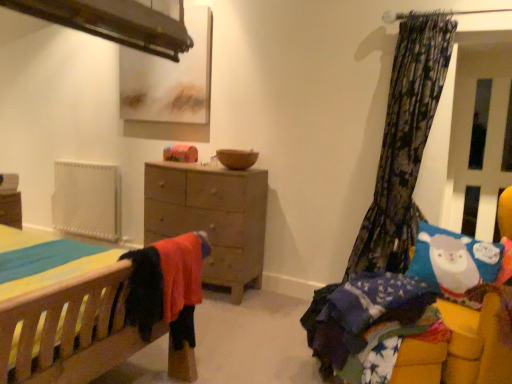
The height and width of the screenshot is (384, 512). What do you see at coordinates (87, 200) in the screenshot?
I see `white textured radiator at left` at bounding box center [87, 200].

What do you see at coordinates (367, 324) in the screenshot? I see `multicolored fabric at lower right` at bounding box center [367, 324].

Image resolution: width=512 pixels, height=384 pixels. Describe the element at coordinates (211, 217) in the screenshot. I see `wooden chest of drawers at center` at that location.

The image size is (512, 384). Find the location of `white textured radiator at left`. white textured radiator at left is located at coordinates (87, 200).

Considering the sizes of objects transparent plastic screen door at right and brown matte bowl at center in the image provided, who is thinner, transparent plastic screen door at right or brown matte bowl at center?

transparent plastic screen door at right is thinner.

Is transparent plastic screen door at right looking in the opposite direction of brown matte bowl at center?

No, transparent plastic screen door at right is not facing the opposite direction of brown matte bowl at center.

What's the angular difference between transparent plastic screen door at right and brown matte bowl at center's facing directions?

transparent plastic screen door at right and brown matte bowl at center are facing 0.385 degrees away from each other.

Can you confirm if transparent plastic screen door at right is thinner than white textured radiator at left?

Correct, the width of transparent plastic screen door at right is less than that of white textured radiator at left.

Considering the relative positions of transparent plastic screen door at right and white textured radiator at left in the image provided, is transparent plastic screen door at right to the right of white textured radiator at left from the viewer's perspective?

Indeed, transparent plastic screen door at right is positioned on the right side of white textured radiator at left.

Is transparent plastic screen door at right taller or shorter than white textured radiator at left?

transparent plastic screen door at right is taller than white textured radiator at left.

Would you consider transparent plastic screen door at right to be distant from white textured radiator at left?

Indeed, transparent plastic screen door at right is not near white textured radiator at left.

Is floral fabric curtain at right not near brown matte bowl at center?

floral fabric curtain at right is far away from brown matte bowl at center.

How many degrees apart are the facing directions of floral fabric curtain at right and brown matte bowl at center?

1.18 degrees separate the facing orientations of floral fabric curtain at right and brown matte bowl at center.

Where is `curtain in front of the brown matte bowl at center`? This screenshot has width=512, height=384. curtain in front of the brown matte bowl at center is located at coordinates (404, 144).

Is floral fabric curtain at right in front of multicolored fabric at lower right?

No, floral fabric curtain at right is further to the viewer.

Is floral fabric curtain at right placed right next to multicolored fabric at lower right?

There is a gap between floral fabric curtain at right and multicolored fabric at lower right.

Is floral fabric curtain at right inside the boundaries of multicolored fabric at lower right, or outside?

floral fabric curtain at right exists outside the volume of multicolored fabric at lower right.

From a real-world perspective, which is physically below, wooden bed at lower left, marked as the 1th bed in a left-to-right arrangement, or transparent plastic screen door at right?

wooden bed at lower left, marked as the 1th bed in a left-to-right arrangement.

Is point (78, 275) closer or farther from the camera than point (457, 223)?

Point (78, 275) is closer to the camera than point (457, 223).

Would you say wooden bed at lower left, marked as the 1th bed in a left-to-right arrangement, is outside transparent plastic screen door at right?

That's correct, wooden bed at lower left, marked as the 1th bed in a left-to-right arrangement, is outside of transparent plastic screen door at right.

Is wooden bed at lower left, marked as the 1th bed in a left-to-right arrangement, looking in the opposite direction of transparent plastic screen door at right?

No, wooden bed at lower left, marked as the 1th bed in a left-to-right arrangement, is not facing the opposite direction of transparent plastic screen door at right.

Considering the sizes of objects transparent plastic screen door at right and matte brown picture frame at upper center in the image provided, who is shorter, transparent plastic screen door at right or matte brown picture frame at upper center?

matte brown picture frame at upper center is shorter.

Which is behind, transparent plastic screen door at right or matte brown picture frame at upper center?

matte brown picture frame at upper center is further from the camera.

In terms of size, does transparent plastic screen door at right appear bigger or smaller than matte brown picture frame at upper center?

Clearly, transparent plastic screen door at right is smaller in size than matte brown picture frame at upper center.

Does point (309, 324) come behind point (60, 217)?

No, it is not.

From a real-world perspective, which is physically below, multicolored fabric at lower right or white textured radiator at left?

multicolored fabric at lower right.

In terms of size, does multicolored fabric at lower right appear bigger or smaller than white textured radiator at left?

multicolored fabric at lower right is smaller than white textured radiator at left.

From the image's perspective, which is below, multicolored fabric at lower right or white textured radiator at left?

A: multicolored fabric at lower right.

This screenshot has height=384, width=512. In order to click on screen door that is in front of the brown matte bowl at center in this screenshot , I will do `click(479, 134)`.

This screenshot has height=384, width=512. In order to click on radiator that appears below the transparent plastic screen door at right (from the image's perspective) in this screenshot , I will do tap(87, 200).

Based on their spatial positions, is white textured radiator at left or brown matte bowl at center further from matte brown picture frame at upper center?

white textured radiator at left.

From the image, which object appears to be nearer to matte brown picture frame at upper center, floral fabric curtain at right or multicolored fabric at lower right?

Among the two, floral fabric curtain at right is located nearer to matte brown picture frame at upper center.

From the image, which object appears to be nearer to fluffy blue blanket at lower right, which is the 1th bed in right-to-left order, transparent plastic screen door at right or wooden chest of drawers at center?

Based on the image, transparent plastic screen door at right appears to be nearer to fluffy blue blanket at lower right, which is the 1th bed in right-to-left order.

Looking at the image, which one is located further to wooden bed at lower left, marked as the 1th bed in a left-to-right arrangement, floral fabric curtain at right or multicolored fabric at lower right?

floral fabric curtain at right.

When comparing their distances from wooden bed at lower left, marked as the 1th bed in a left-to-right arrangement, does multicolored fabric at lower right or matte brown picture frame at upper center seem further?

matte brown picture frame at upper center lies further to wooden bed at lower left, marked as the 1th bed in a left-to-right arrangement, than the other object.

From the image, which object appears to be nearer to brown matte bowl at center, fluffy blue blanket at lower right, placed as the 2th bed when sorted from left to right, or floral fabric curtain at right?

floral fabric curtain at right.

When comparing their distances from wooden chest of drawers at center, does multicolored fabric at lower right or transparent plastic screen door at right seem further?

Based on the image, transparent plastic screen door at right appears to be further to wooden chest of drawers at center.

Considering their positions, is multicolored fabric at lower right positioned closer to brown matte bowl at center than transparent plastic screen door at right?

multicolored fabric at lower right.

You are a GUI agent. You are given a task and a screenshot of the screen. Output one action in this format:
    pyautogui.click(x=<x>, y=<y>)
    Task: Click on the bed located between matte brown picture frame at upper center and floral fabric curtain at right in the left-right direction
    
    Given the screenshot: What is the action you would take?
    pyautogui.click(x=394, y=296)

Identify the location of nightstand situated between white textured radiator at left and brown matte bowl at center from left to right. (211, 217).

At what (x,y) coordinates should I click in order to perform the action: click on blanket located between fluffy blue blanket at lower right, which is the 1th bed in right-to-left order, and wooden chest of drawers at center in the depth direction. Please return your answer as a coordinate pair (x, y). The width and height of the screenshot is (512, 384). Looking at the image, I should click on (367, 324).

At what (x,y) coordinates should I click in order to perform the action: click on bowl located between wooden bed at lower left, marked as the 1th bed in a left-to-right arrangement, and floral fabric curtain at right in the left-right direction. Please return your answer as a coordinate pair (x, y). Looking at the image, I should click on (237, 158).